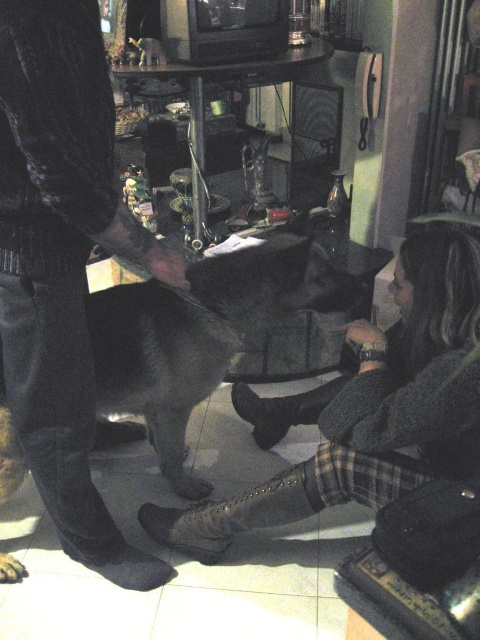
You are a photographer trying to capture a photo of the black dog in the scene. You notice the dark corduroy pants at left and the leather boot at lower center in your shot. Which object is closer to the camera?

The dark corduroy pants at left is much taller as the leather boot at lower center, so the dark corduroy pants at left is closer to the camera.

You are standing in the room and see two points marked in the image. Which point is closer to you, point (x=323, y=416) or point (x=192, y=506)?

Point (x=323, y=416) is closer to the viewer than point (x=192, y=506).

You are standing in a dimly lit room with a black dog on a tiled floor. You see a dark gray sweater at center and a leather boot at lower center. Which object is taller?

The dark gray sweater at center is much taller than the leather boot at lower center.